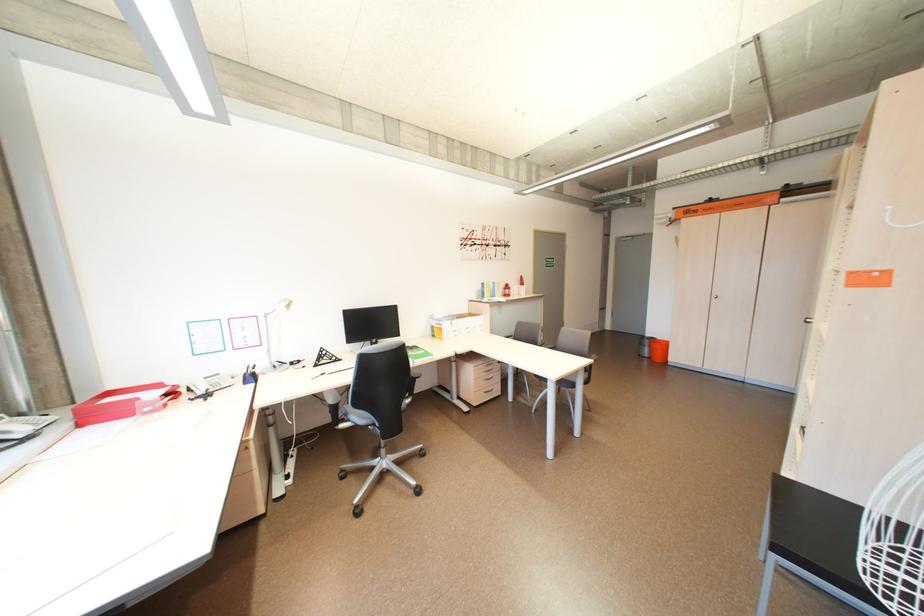
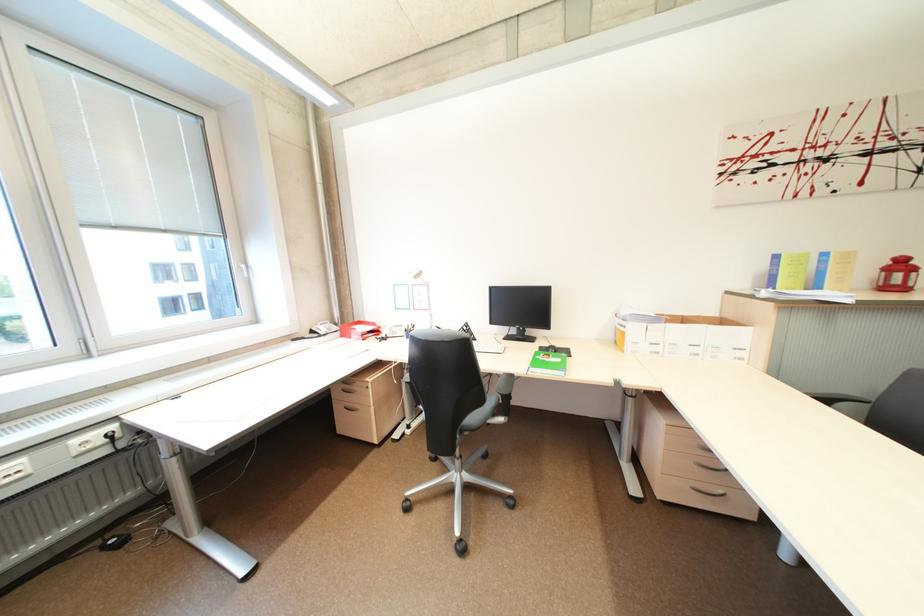
Where in the second image is the point corresponding to (492,285) from the first image?

(785, 257)